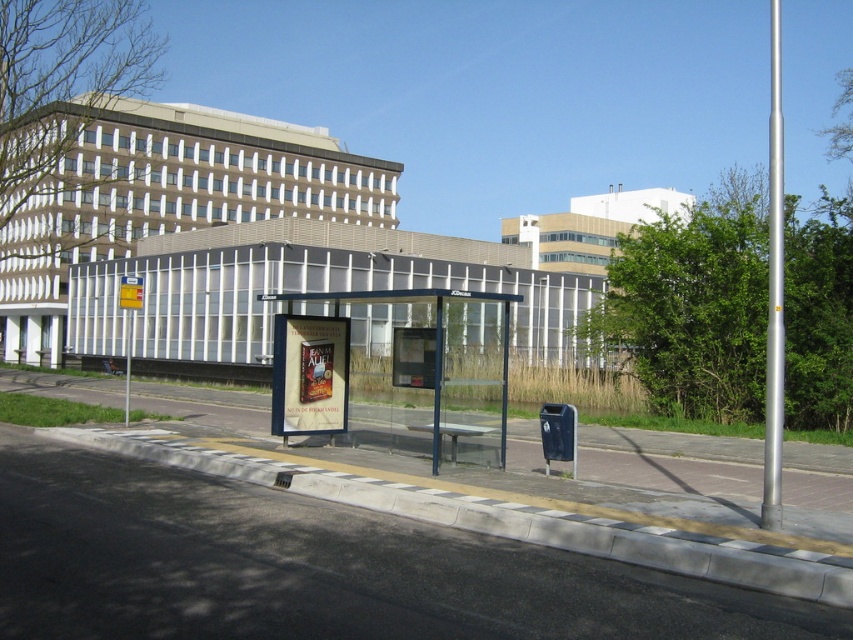
Question: Which object appears farthest from the camera in this image?

Choices:
 (A) gray concrete curb at lower center
 (B) transparent glass bus stop at center

Answer: (B)

Question: Considering the relative positions of gray concrete curb at lower center and transparent glass bus stop at center in the image provided, where is gray concrete curb at lower center located with respect to transparent glass bus stop at center?

Choices:
 (A) left
 (B) right

Answer: (B)

Question: Can you confirm if gray concrete curb at lower center is positioned to the right of transparent glass bus stop at center?

Choices:
 (A) no
 (B) yes

Answer: (B)

Question: Which of the following is the farthest from the observer?

Choices:
 (A) gray concrete curb at lower center
 (B) transparent glass bus stop at center

Answer: (B)

Question: Does gray concrete curb at lower center appear on the left side of transparent glass bus stop at center?

Choices:
 (A) yes
 (B) no

Answer: (B)